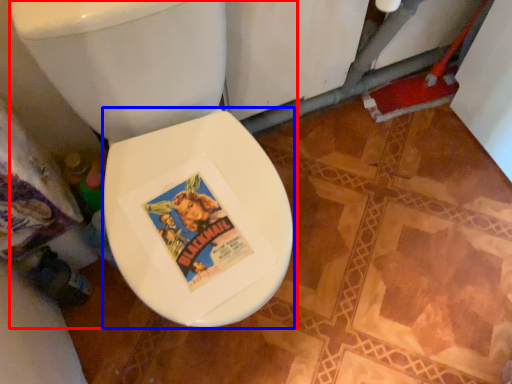
Question: Which object is closer to the camera taking this photo, toilet (highlighted by a red box) or bidet (highlighted by a blue box)?

Choices:
 (A) toilet
 (B) bidet

Answer: (A)